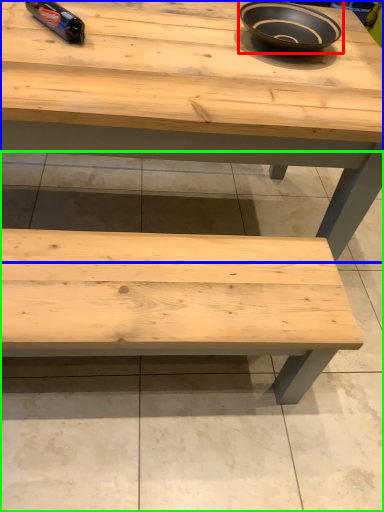
Question: Based on their relative distances, which object is nearer to bowl (highlighted by a red box)? Choose from table (highlighted by a blue box) and concrete (highlighted by a green box).

Choices:
 (A) table
 (B) concrete

Answer: (A)